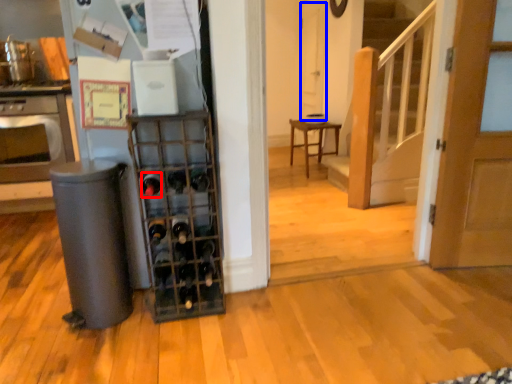
Question: Which object is further to the camera taking this photo, wine bottle (highlighted by a red box) or screen door (highlighted by a blue box)?

Choices:
 (A) wine bottle
 (B) screen door

Answer: (B)